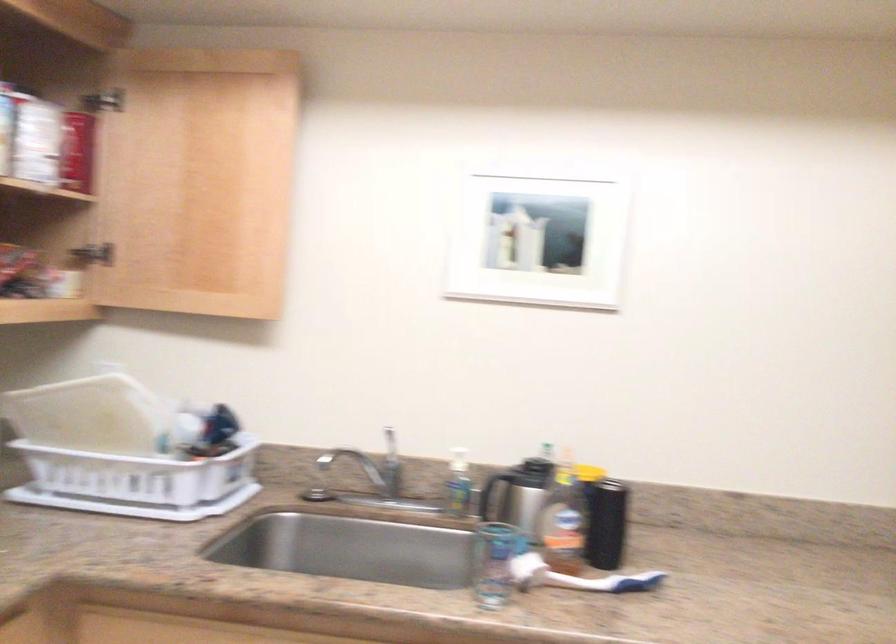
Locate an element on the screen. The width and height of the screenshot is (896, 644). silver thermos handle is located at coordinates (265, 543).